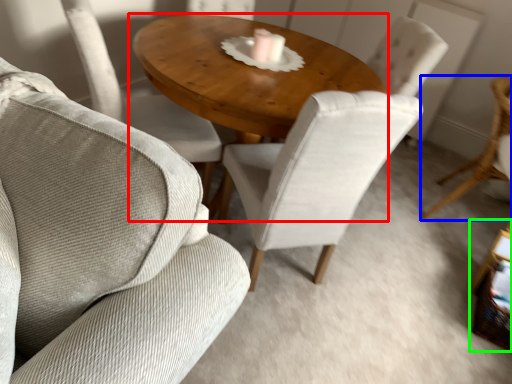
Question: Which object is positioned farthest from coffee table (highlighted by a red box)? Select from chair (highlighted by a blue box) and side table (highlighted by a green box).

Choices:
 (A) chair
 (B) side table

Answer: (B)